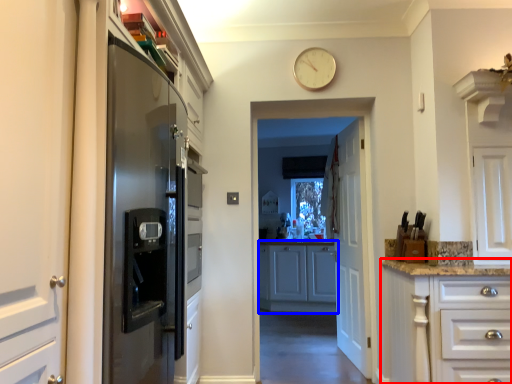
Question: Which object is closer to the camera taking this photo, cabinetry (highlighted by a red box) or cabinetry (highlighted by a blue box)?

Choices:
 (A) cabinetry
 (B) cabinetry

Answer: (A)